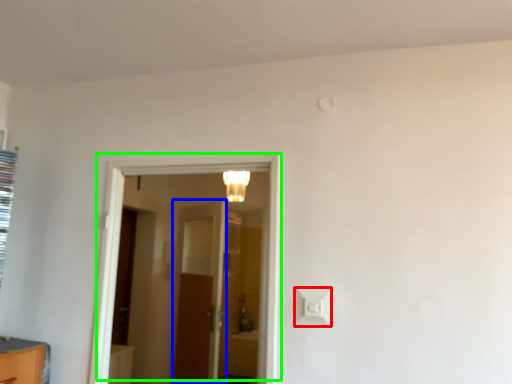
Question: Considering the real-world distances, which object is closest to light switch (highlighted by a red box)? door (highlighted by a blue box) or door (highlighted by a green box).

Choices:
 (A) door
 (B) door

Answer: (B)